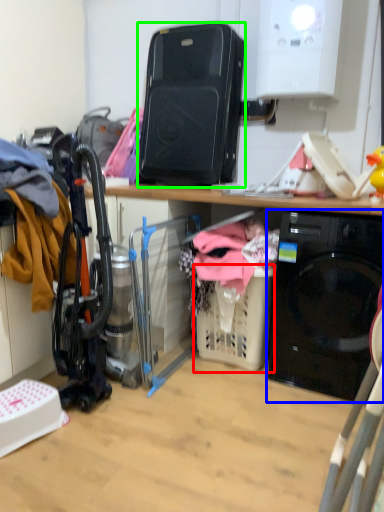
Question: Based on their relative distances, which object is farther from basket (highlighted by a red box)? Choose from home appliance (highlighted by a blue box) and appliance (highlighted by a green box).

Choices:
 (A) home appliance
 (B) appliance

Answer: (B)